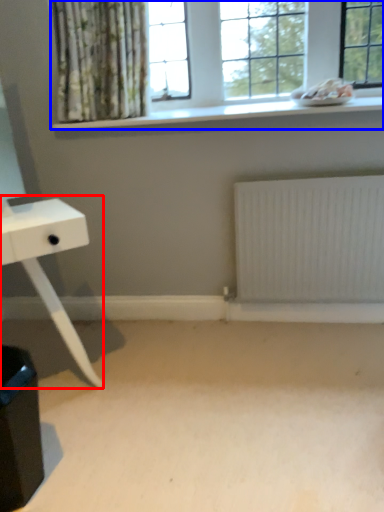
Question: Which object is closer to the camera taking this photo, table (highlighted by a red box) or window (highlighted by a blue box)?

Choices:
 (A) table
 (B) window

Answer: (A)